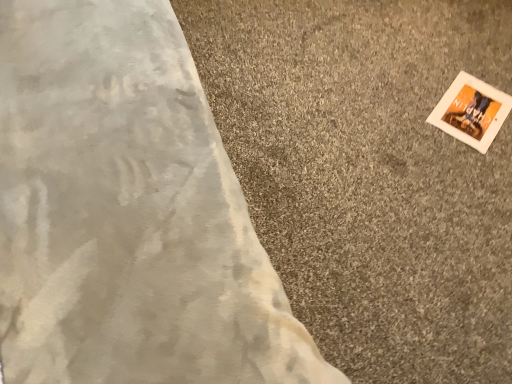
Question: From a real-world perspective, relative to white soft carpet at upper right, is white matte picture frame at upper right vertically above or below?

Choices:
 (A) below
 (B) above

Answer: (B)

Question: Looking at their shapes, would you say white matte picture frame at upper right is wider or thinner than white soft carpet at upper right?

Choices:
 (A) thin
 (B) wide

Answer: (A)

Question: Does point (470, 109) appear closer or farther from the camera than point (333, 256)?

Choices:
 (A) closer
 (B) farther

Answer: (B)

Question: From their relative heights in the image, would you say white soft carpet at upper right is taller or shorter than white matte picture frame at upper right?

Choices:
 (A) tall
 (B) short

Answer: (A)

Question: Considering the positions of point (433, 150) and point (461, 129), is point (433, 150) closer or farther from the camera than point (461, 129)?

Choices:
 (A) closer
 (B) farther

Answer: (A)

Question: Based on their sizes in the image, would you say white soft carpet at upper right is bigger or smaller than white matte picture frame at upper right?

Choices:
 (A) big
 (B) small

Answer: (A)

Question: From a real-world perspective, is white soft carpet at upper right positioned above or below white matte picture frame at upper right?

Choices:
 (A) below
 (B) above

Answer: (A)